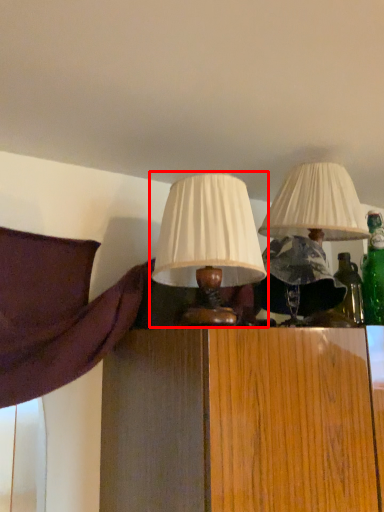
Question: Considering the relative positions of lamp (annotated by the red box) and lamp in the image provided, where is lamp (annotated by the red box) located with respect to the staircase?

Choices:
 (A) right
 (B) left

Answer: (B)